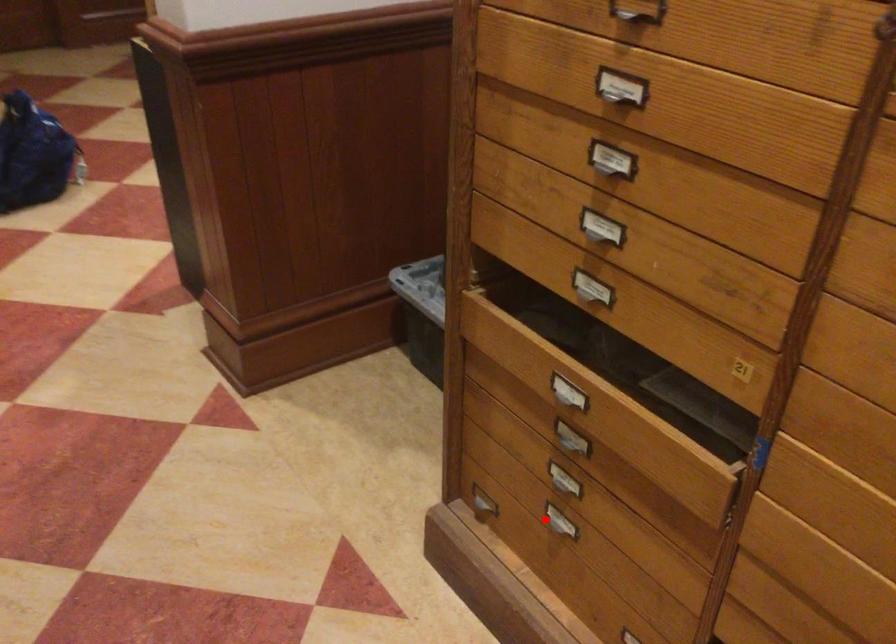
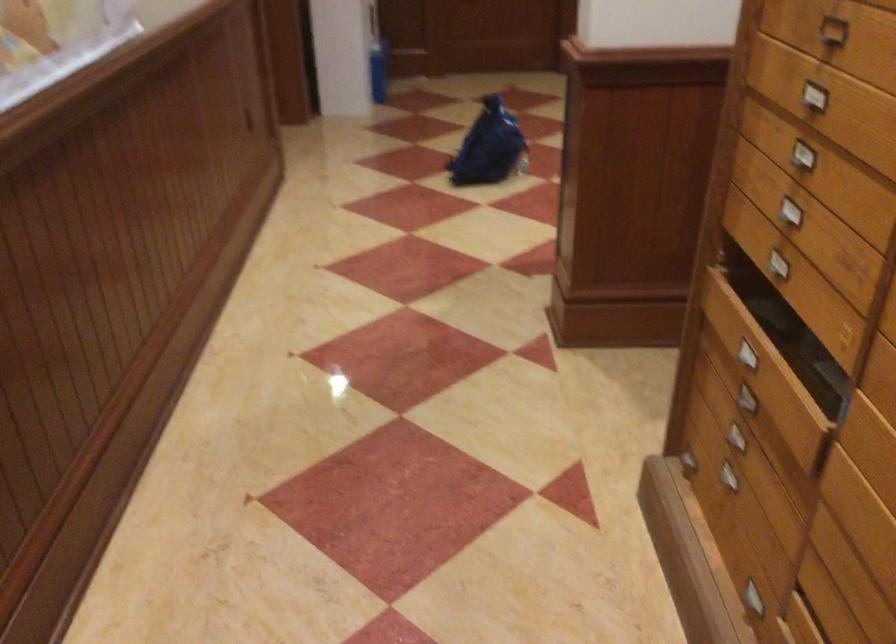
Find the pixel in the second image that matches the highlighted location in the first image.

(725, 476)